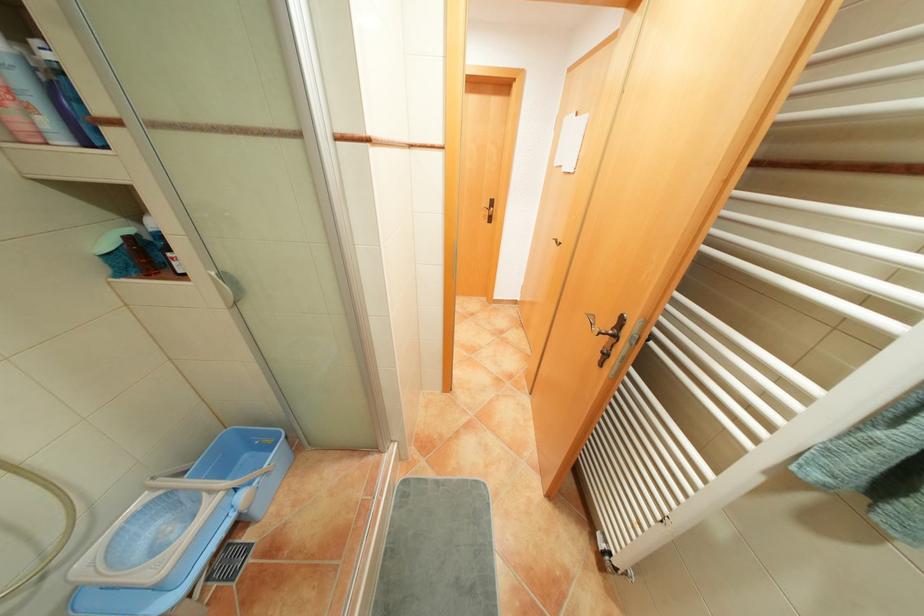
Describe the element at coordinates (245, 498) in the screenshot. The width and height of the screenshot is (924, 616). I see `the radiator valve knob` at that location.